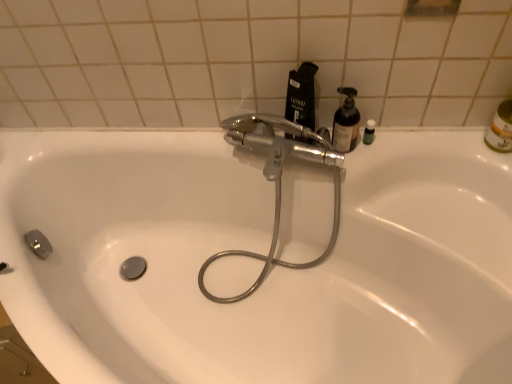
Question: Is chrome metallic faucet at center taller or shorter than black matte bottle at upper center?

Choices:
 (A) short
 (B) tall

Answer: (B)

Question: Relative to black matte bottle at upper center, is chrome metallic faucet at center in front or behind?

Choices:
 (A) front
 (B) behind

Answer: (A)

Question: Estimate the real-world distances between objects in this image. Which object is closer to the white glossy sink at center?

Choices:
 (A) green matte bottle at upper right
 (B) black matte bottle at upper center
 (C) translucent plastic bottle at upper right
 (D) chrome metallic faucet at center

Answer: (D)

Question: Which of these objects is positioned closest to the white glossy sink at center?

Choices:
 (A) translucent plastic bottle at upper right
 (B) chrome metallic faucet at center
 (C) black matte bottle at upper center
 (D) green matte bottle at upper right

Answer: (B)